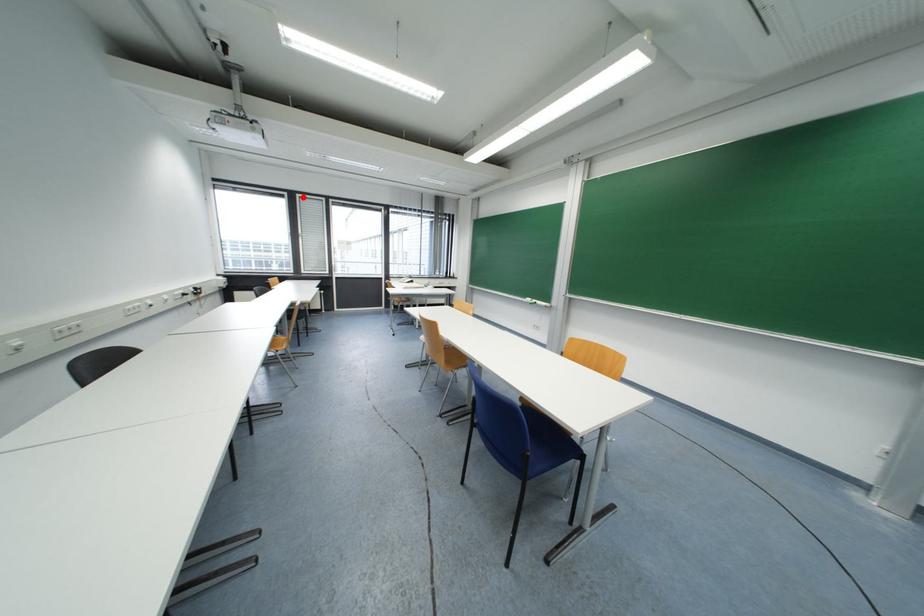
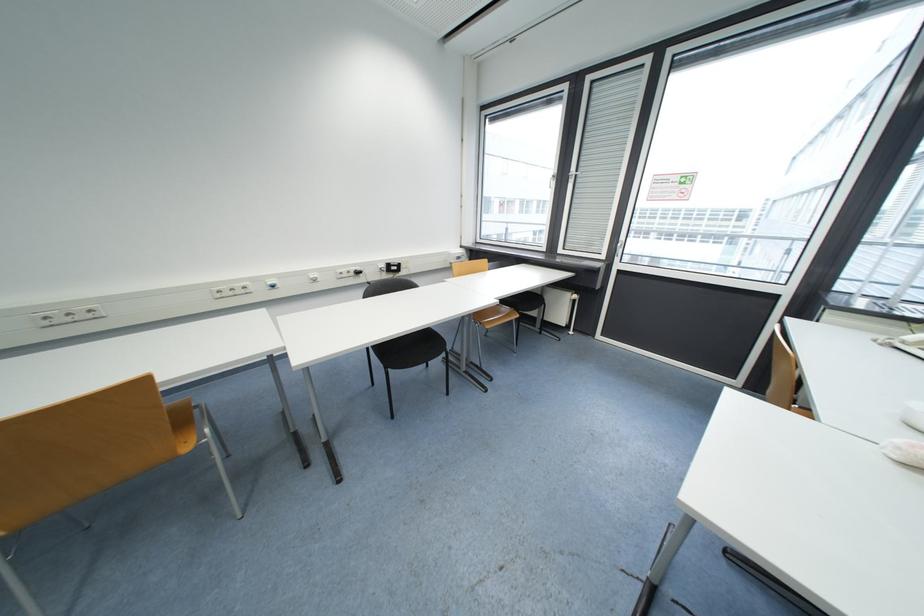
Where in the second image is the point corresponding to the highlighted location from the first image?

(593, 81)